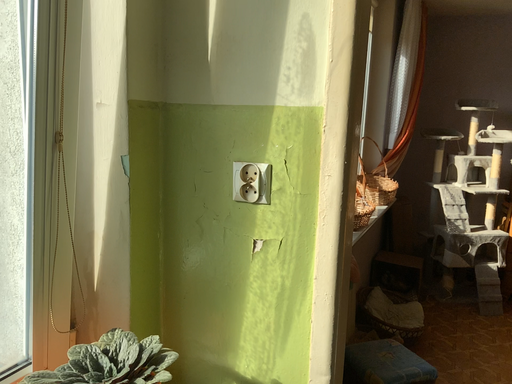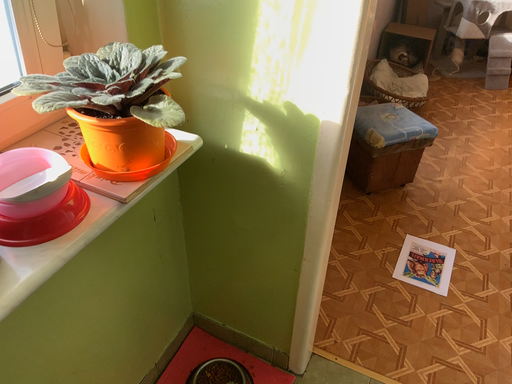
Question: How did the camera likely rotate when shooting the video?

Choices:
 (A) rotated downward
 (B) rotated upward

Answer: (A)